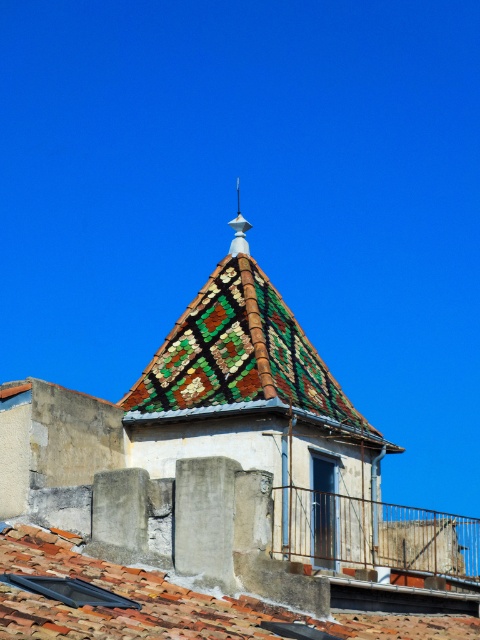
Does terracotta clay tiles at lower left come in front of white glossy spire at upper center?

Yes, it is.

Is terracotta clay tiles at lower left wider than white glossy spire at upper center?

Yes.

Between point (19, 560) and point (239, 243), which one is positioned behind?

The point (239, 243) is more distant.

Locate an element on the screen. terracotta clay tiles at lower left is located at coordinates (168, 604).

Which is in front, point (257, 280) or point (182, 627)?

Positioned in front is point (182, 627).

Locate an element on the screen. Image resolution: width=480 pixels, height=640 pixels. mosaic tile roof at center is located at coordinates (x=241, y=360).

Which is in front, point (213, 385) or point (247, 253)?

Point (213, 385) is more forward.

Consider the image. Is mosaic tile roof at center further to the viewer compared to white glossy spire at upper center?

No, mosaic tile roof at center is in front of white glossy spire at upper center.

Who is more forward, (144, 384) or (240, 225)?

Positioned in front is point (144, 384).

Identify the location of mosaic tile roof at center. The width and height of the screenshot is (480, 640). (241, 360).